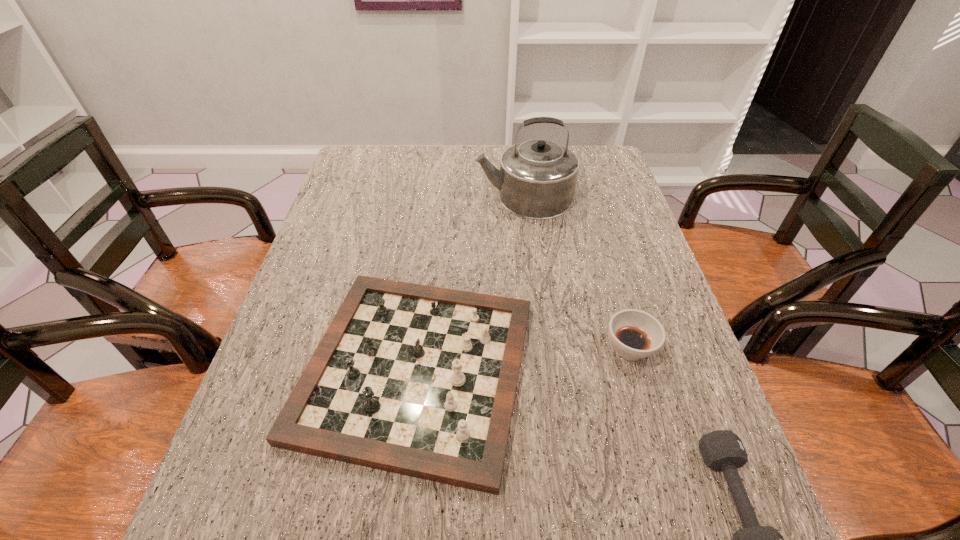
Find the location of a particular element. This screenshot has height=540, width=960. vacant space that is in between the soup bowl and the farthest object is located at coordinates (577, 273).

In order to click on free spot between the soup bowl and the kettle in this screenshot , I will do `click(577, 273)`.

Locate an element on the screen. empty space between the soup bowl and the second tallest object is located at coordinates (523, 359).

Locate an element on the screen. The width and height of the screenshot is (960, 540). object identified as the third closest to the tallest object is located at coordinates (722, 450).

In order to click on object that is the third closest to the tallest object in this screenshot , I will do `click(722, 450)`.

At what (x,y) coordinates should I click in order to perform the action: click on free space that satisfies the following two spatial constraints: 1. on the back side of the soup bowl; 2. on the left side of the second tallest object. Please return your answer as a coordinate pair (x, y). This screenshot has width=960, height=540. Looking at the image, I should click on (419, 349).

Find the location of a particular element. The width and height of the screenshot is (960, 540). vacant space that satisfies the following two spatial constraints: 1. with the spout at the front of the soup bowl; 2. on the right side of the kettle is located at coordinates (542, 349).

The image size is (960, 540). What are the coordinates of `vacant point that satisfies the following two spatial constraints: 1. on the back side of the chessboard; 2. on the right side of the soup bowl` in the screenshot? It's located at (419, 349).

Find the location of a particular element. The image size is (960, 540). vacant space that satisfies the following two spatial constraints: 1. on the back side of the soup bowl; 2. with the spout at the front of the farthest object is located at coordinates (586, 197).

Where is `vacant region that satisfies the following two spatial constraints: 1. on the back side of the soup bowl; 2. with the spout at the front of the tallest object`? vacant region that satisfies the following two spatial constraints: 1. on the back side of the soup bowl; 2. with the spout at the front of the tallest object is located at coordinates (586, 197).